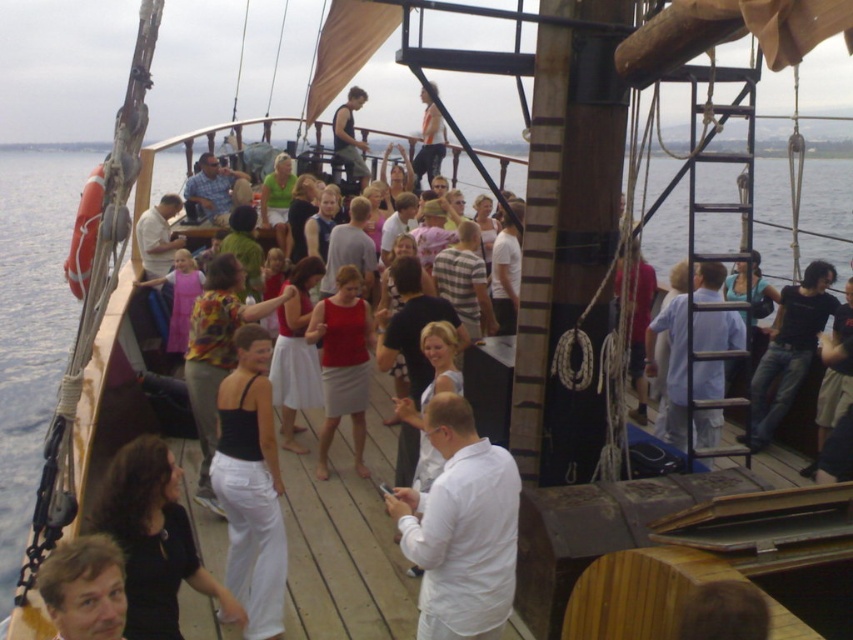
You are on a wooden sailing ship deck and see a light blue fabric shirt at right and a floral fabric dress at center. Which clothing item is positioned lower on the deck?

The light blue fabric shirt at right is located below the floral fabric dress at center, so it is positioned lower on the deck.

You are a photographer on the deck of the ship and want to take a photo of both the white matte shirt at center and the black matte tank top at center. Which one will appear larger in the photo?

The white matte shirt at center will appear larger in the photo because it is closer to the viewer than the black matte tank top at center.